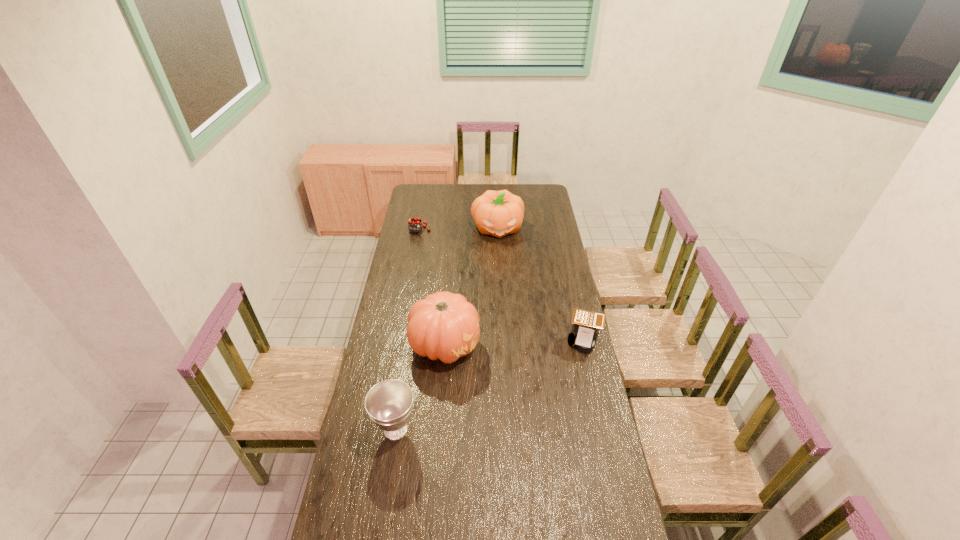
Locate an element on the screen. chalice is located at coordinates (389, 403).

Identify the location of the nearest object. (389, 403).

At what (x,y) coordinates should I click in order to perform the action: click on the rightmost object. Please return your answer as a coordinate pair (x, y). Looking at the image, I should click on (586, 324).

Locate an element on the screen. This screenshot has height=540, width=960. pot filled with cherries is located at coordinates (414, 223).

Where is `the farther pumpkin`? The image size is (960, 540). the farther pumpkin is located at coordinates (499, 213).

The image size is (960, 540). Find the location of `the nearer pumpkin`. the nearer pumpkin is located at coordinates (444, 325).

Identify the location of free space located 0.060m on the back of the third shortest object. (401, 396).

You are a GUI agent. You are given a task and a screenshot of the screen. Output one action in this format:
    pyautogui.click(x=<x>, y=<y>)
    Task: Click on the vacant point located on the front of the rightmost object
    The width and height of the screenshot is (960, 540).
    Given the screenshot: What is the action you would take?
    pyautogui.click(x=601, y=407)

Image resolution: width=960 pixels, height=540 pixels. Find the location of `free space located on the handle side of the pot filled with cherries`. free space located on the handle side of the pot filled with cherries is located at coordinates (426, 241).

Locate an element on the screen. vacant space situated 0.060m on the handle side of the pot filled with cherries is located at coordinates (427, 242).